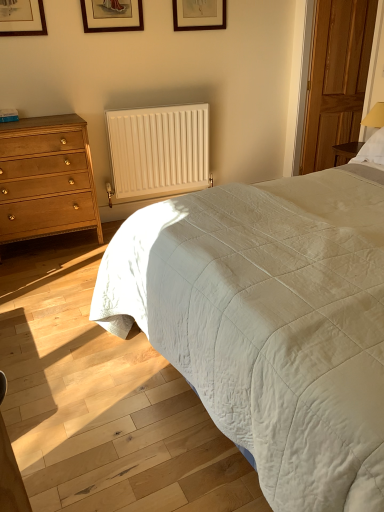
Question: Is the surface of white quilted bed at right in direct contact with wooden picture frame at upper center, which is counted as the 1th picture frame, starting from the right?

Choices:
 (A) no
 (B) yes

Answer: (A)

Question: Considering the relative sizes of white quilted bed at right and wooden picture frame at upper center, acting as the second picture frame starting from the left, in the image provided, is white quilted bed at right taller than wooden picture frame at upper center, acting as the second picture frame starting from the left,?

Choices:
 (A) yes
 (B) no

Answer: (A)

Question: Does white quilted bed at right have a greater width compared to wooden picture frame at upper center, the second picture frame from the front?

Choices:
 (A) yes
 (B) no

Answer: (A)

Question: From the image's perspective, does white quilted bed at right appear higher than wooden picture frame at upper center, which is counted as the 1th picture frame, starting from the right?

Choices:
 (A) no
 (B) yes

Answer: (A)

Question: Could wooden picture frame at upper center, the second picture frame from the front, be considered to be inside white quilted bed at right?

Choices:
 (A) no
 (B) yes

Answer: (A)

Question: Does white quilted bed at right have a smaller size compared to wooden picture frame at upper center, the second picture frame from the front?

Choices:
 (A) no
 (B) yes

Answer: (A)

Question: Is white matte radiator at center not within wooden picture frame at upper center, which is the 1th picture frame from left to right?

Choices:
 (A) no
 (B) yes

Answer: (B)

Question: Can you confirm if white matte radiator at center is thinner than wooden picture frame at upper center, which is counted as the 1th picture frame, starting from the front?

Choices:
 (A) yes
 (B) no

Answer: (B)

Question: Can you confirm if white matte radiator at center is taller than wooden picture frame at upper center, which is the 1th picture frame from left to right?

Choices:
 (A) no
 (B) yes

Answer: (B)

Question: From the image's perspective, is white matte radiator at center located beneath wooden picture frame at upper center, placed as the second picture frame when sorted from back to front?

Choices:
 (A) yes
 (B) no

Answer: (A)

Question: Considering the relative positions of white matte radiator at center and wooden picture frame at upper center, placed as the second picture frame when sorted from right to left, in the image provided, is white matte radiator at center to the left of wooden picture frame at upper center, placed as the second picture frame when sorted from right to left, from the viewer's perspective?

Choices:
 (A) no
 (B) yes

Answer: (A)

Question: Can you confirm if white matte radiator at center is smaller than wooden picture frame at upper center, placed as the second picture frame when sorted from right to left?

Choices:
 (A) no
 (B) yes

Answer: (A)

Question: Can you confirm if wooden picture frame at upper center, acting as the second picture frame starting from the left, is smaller than wooden picture frame at upper center, placed as the second picture frame when sorted from back to front?

Choices:
 (A) no
 (B) yes

Answer: (A)